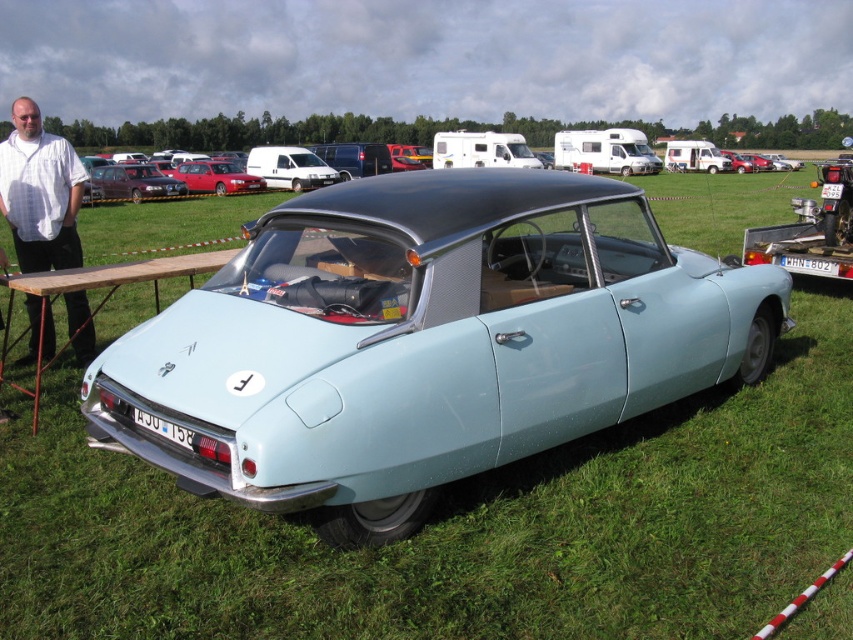
You are a photographer at the car show and want to take a photo of the vintage Citroen DS. You need to place two markers at the coordinates point (22, 156) and point (49, 282). From the camera position, which marker is closer to the front of the car?

Point (49, 282) is closer to the front of the car because it is in front of point (22, 156).

You are a photographer at a car show and need to set up a backdrop that is 1.8 meters tall. The backdrop needs to be tall enough to cover the entire height of both the metallic red car at center and the shiny red car at center. Based on the description, will the backdrop be sufficient for both cars?

The metallic red car at center is much taller than the shiny red car at center. Since the backdrop is 1.8 meters tall, it may not be sufficient for the metallic red car at center if its height exceeds 1.8 meters. However, the description does not provide the exact height of the cars, only their relative sizes. Therefore, we cannot definitively confirm if the backdrop will be sufficient for both cars without additional information.